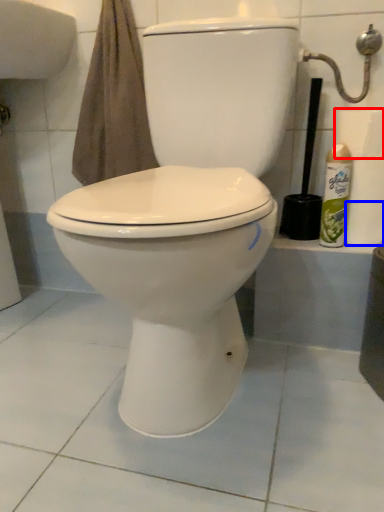
Question: Which point is further to the camera, toilet paper (highlighted by a red box) or toilet paper (highlighted by a blue box)?

Choices:
 (A) toilet paper
 (B) toilet paper

Answer: (B)